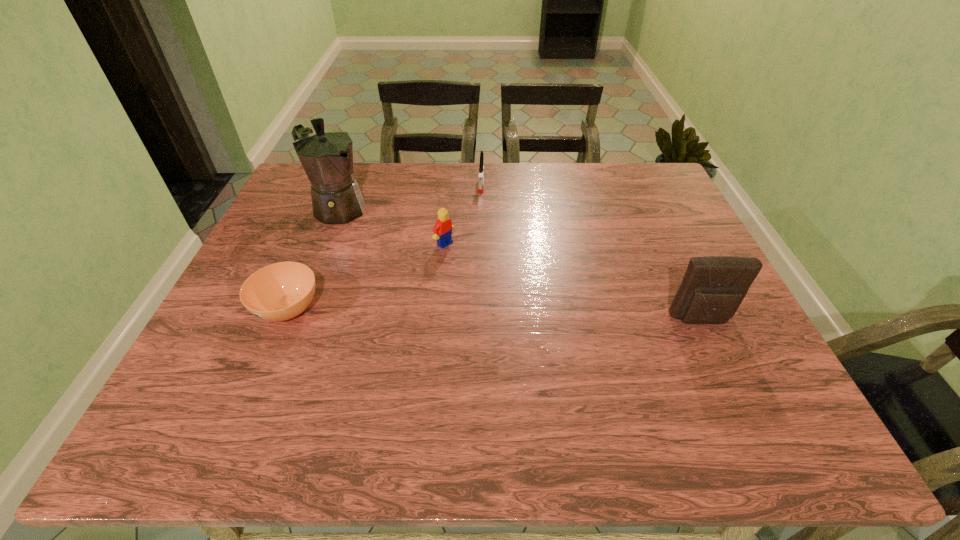
At what (x,y) coordinates should I click in order to perform the action: click on stapler that is positioned at the far edge. Please return your answer as a coordinate pair (x, y). Image resolution: width=960 pixels, height=540 pixels. Looking at the image, I should click on (481, 173).

The height and width of the screenshot is (540, 960). I want to click on soup bowl that is at the left edge, so click(281, 291).

This screenshot has height=540, width=960. Identify the location of coffeepot at the left edge. (326, 155).

The height and width of the screenshot is (540, 960). I want to click on object located at the right edge, so click(x=713, y=287).

Image resolution: width=960 pixels, height=540 pixels. Identify the location of object situated at the far left corner. (326, 155).

In the image, there is a desktop. At what (x,y) coordinates should I click in order to perform the action: click on vacant space at the far edge. Please return your answer as a coordinate pair (x, y). Looking at the image, I should click on (478, 176).

Where is `free space at the left edge of the desktop`? Image resolution: width=960 pixels, height=540 pixels. free space at the left edge of the desktop is located at coordinates (284, 253).

Where is `free spot at the right edge of the desktop`? free spot at the right edge of the desktop is located at coordinates (636, 220).

Find the location of a particular element. This screenshot has width=960, height=540. free region at the near left corner is located at coordinates (220, 361).

In the image, there is a desktop. Where is `free space at the near right corner`? The height and width of the screenshot is (540, 960). free space at the near right corner is located at coordinates (724, 387).